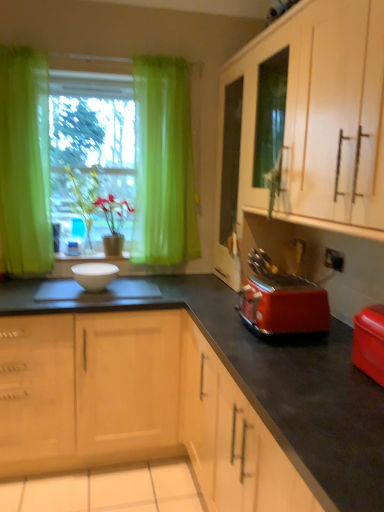
Question: From the image's perspective, is white glossy bowl at center located above or below red plastic toaster at lower right?

Choices:
 (A) below
 (B) above

Answer: (B)

Question: In terms of height, does white glossy bowl at center look taller or shorter compared to red plastic toaster at lower right?

Choices:
 (A) tall
 (B) short

Answer: (B)

Question: Which of these objects is positioned farthest from the matte plastic container at lower right?

Choices:
 (A) green sheer curtain at left
 (B) white glossy bowl at center
 (C) green leafy plant at center
 (D) red plastic toaster at lower right
 (E) matte wood cabinet at upper right

Answer: (A)

Question: Which object is positioned farthest from the green leafy plant at center?

Choices:
 (A) matte plastic container at lower right
 (B) red plastic toaster at lower right
 (C) white glossy bowl at center
 (D) green sheer curtain at left
 (E) matte wood cabinet at upper right

Answer: (A)